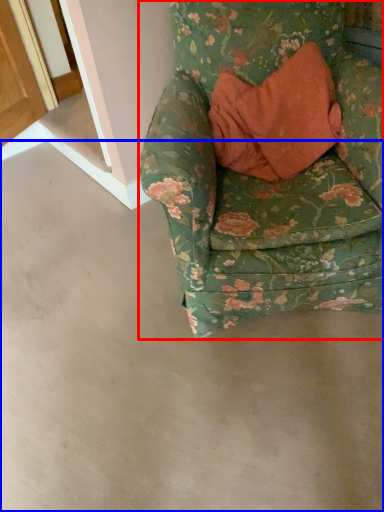
Question: Which of the following is the closest to the observer, chair (highlighted by a red box) or concrete (highlighted by a blue box)?

Choices:
 (A) chair
 (B) concrete

Answer: (B)